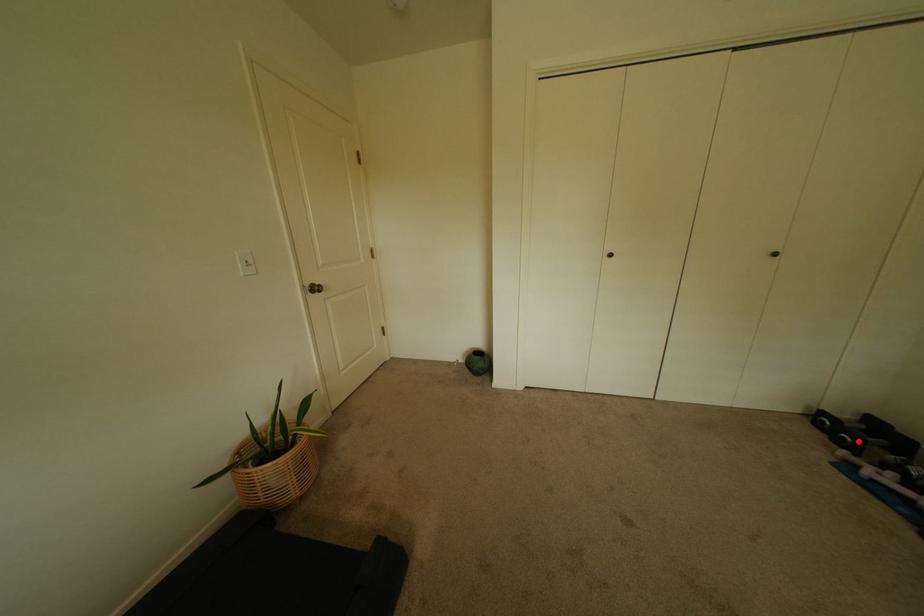
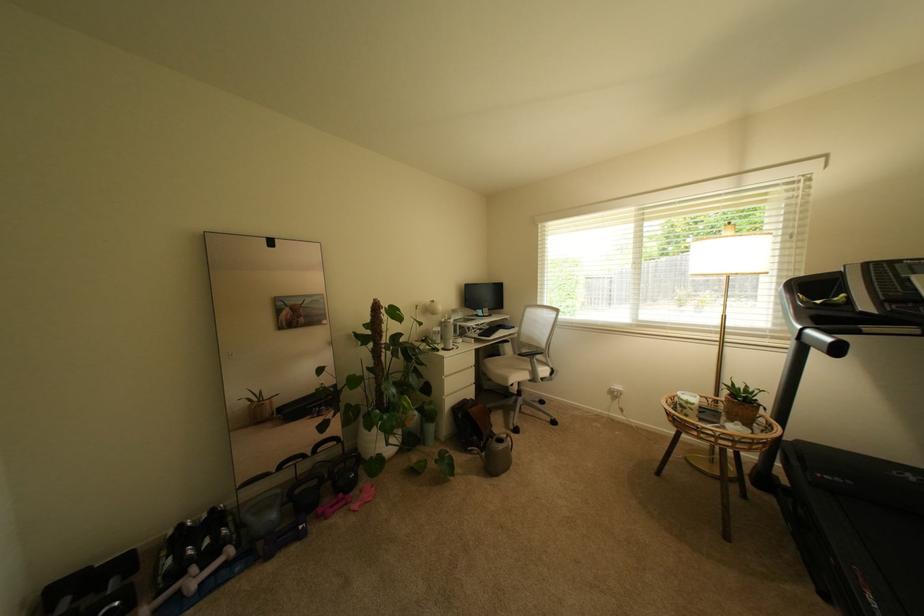
In the second image, find the point that corresponds to the highlighted location in the first image.

(126, 604)